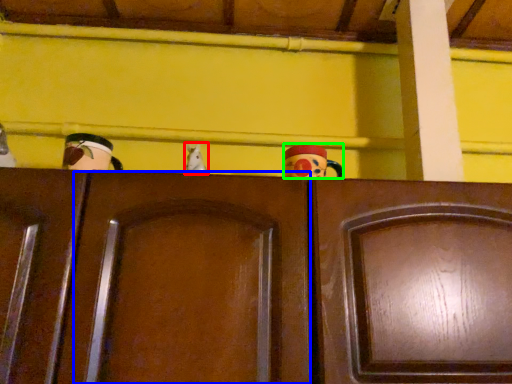
Question: Based on their relative distances, which object is farther from toy (highlighted by a red box)? Choose from door (highlighted by a blue box) and toy (highlighted by a green box).

Choices:
 (A) door
 (B) toy

Answer: (A)